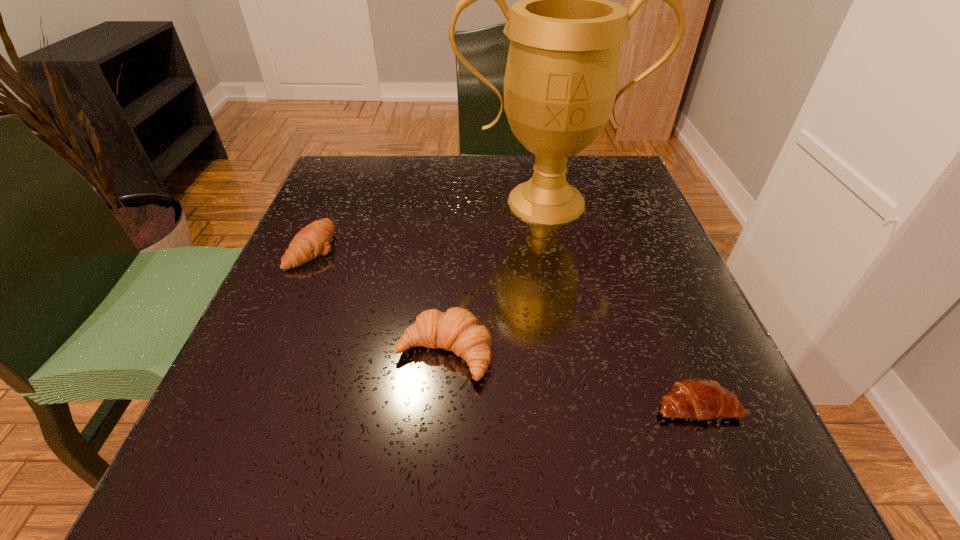
I want to click on free region at the far left corner of the desktop, so click(x=384, y=188).

Where is `vacant space at the near left corner of the desktop`? Image resolution: width=960 pixels, height=540 pixels. vacant space at the near left corner of the desktop is located at coordinates (298, 510).

In the image, there is a desktop. Find the location of `vacant space at the far right corner`. vacant space at the far right corner is located at coordinates (594, 204).

The image size is (960, 540). In order to click on unoccupied position between the leftmost crescent roll and the tallest crescent roll in this screenshot , I will do `click(379, 300)`.

You are a GUI agent. You are given a task and a screenshot of the screen. Output one action in this format:
    pyautogui.click(x=<x>, y=<y>)
    Task: Click on the vacant point located between the tallest object and the shortest crescent roll
    Image resolution: width=960 pixels, height=540 pixels.
    Given the screenshot: What is the action you would take?
    pyautogui.click(x=621, y=303)

The width and height of the screenshot is (960, 540). Identify the location of vacant space that is in between the trophy and the shortest object. (621, 303).

I want to click on vacant region between the third shortest object and the shortest object, so click(570, 379).

At what (x,y) coordinates should I click in order to perform the action: click on free point between the rightmost crescent roll and the trophy. Please return your answer as a coordinate pair (x, y). Image resolution: width=960 pixels, height=540 pixels. Looking at the image, I should click on (621, 303).

At what (x,y) coordinates should I click in order to perform the action: click on free area in between the farthest crescent roll and the second crescent roll from right to left. Please return your answer as a coordinate pair (x, y). The width and height of the screenshot is (960, 540). Looking at the image, I should click on (379, 300).

Locate an element on the screen. This screenshot has width=960, height=540. free space between the second tallest object and the rightmost crescent roll is located at coordinates (570, 379).